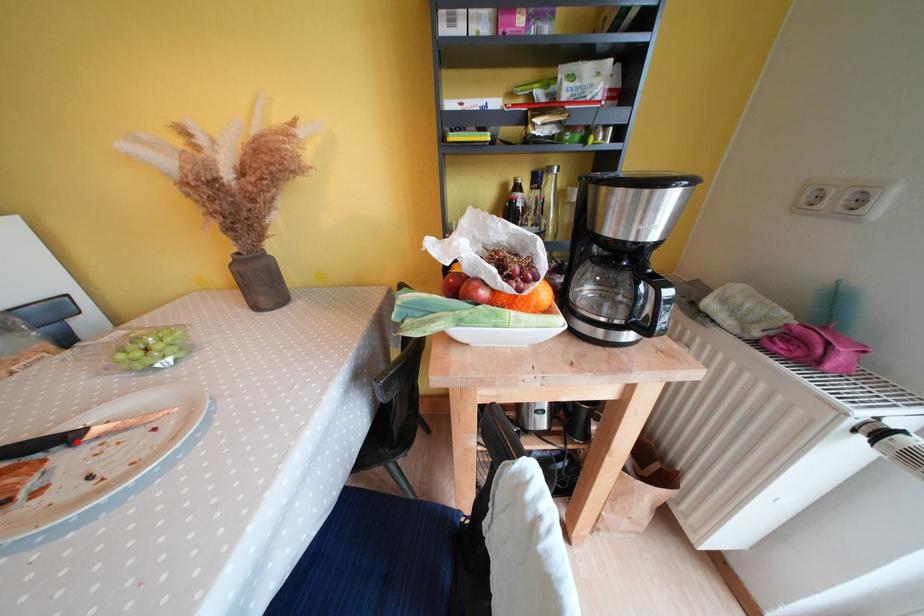
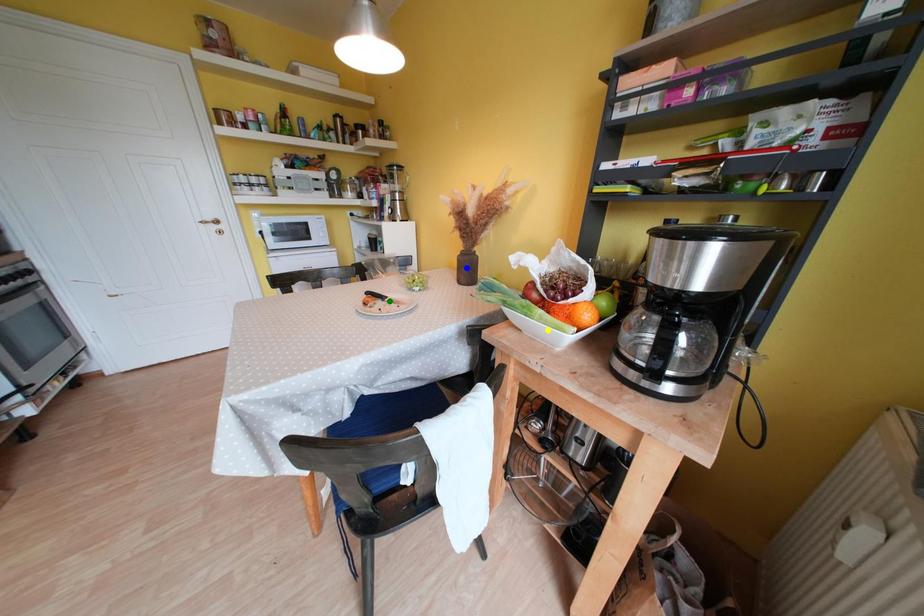
Question: I am providing you with two images of the same scene from different viewpoints. A red point is marked on the first image. You are given multiple points on the second image. Which spot in image 2 lines up with the point in image 1?

Choices:
 (A) yellow point
 (B) green point
 (C) blue point

Answer: (B)